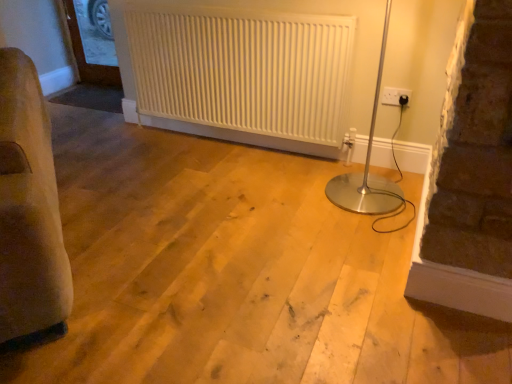
This screenshot has width=512, height=384. I want to click on blank area beneath white textured radiator at center (from a real-world perspective), so click(x=232, y=134).